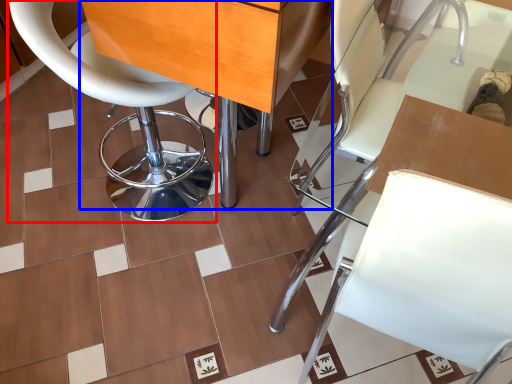
Question: Which point is further to the camera, chair (highlighted by a red box) or table (highlighted by a blue box)?

Choices:
 (A) chair
 (B) table

Answer: (A)